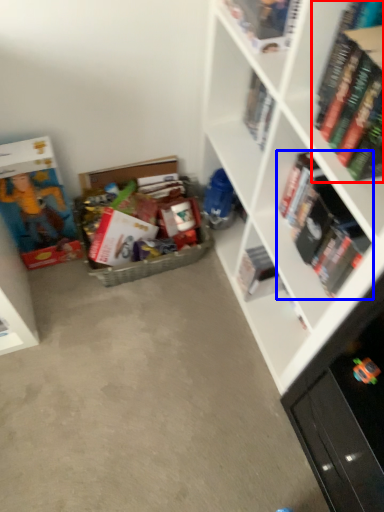
Question: Among these objects, which one is farthest to the camera, book (highlighted by a red box) or book (highlighted by a blue box)?

Choices:
 (A) book
 (B) book

Answer: (B)